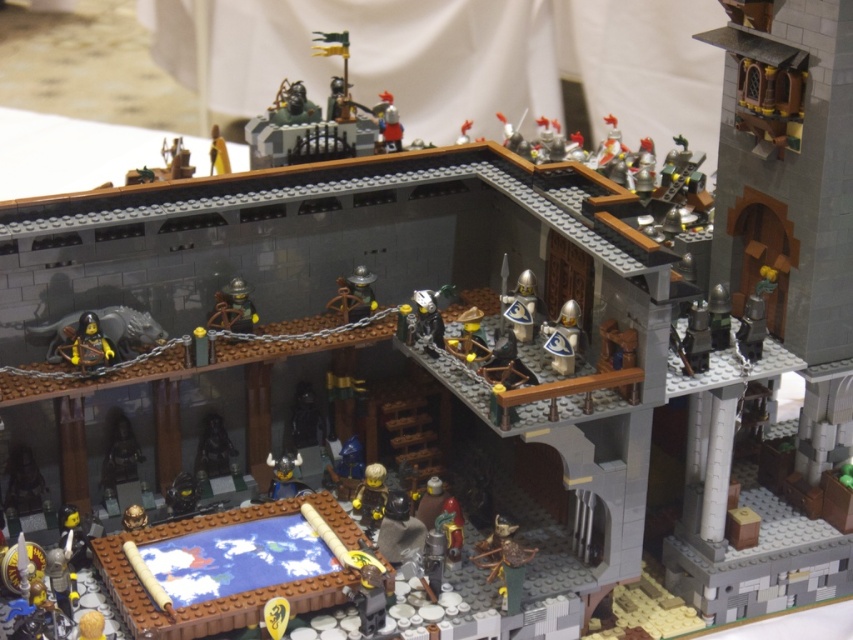
Question: Does matte black knight at center lie behind shiny silver helmet at center?

Choices:
 (A) no
 (B) yes

Answer: (B)

Question: Which point is closer to the camera?

Choices:
 (A) (245, 292)
 (B) (96, 332)

Answer: (B)

Question: Which point appears farthest from the camera in this image?

Choices:
 (A) (216, 422)
 (B) (213, 314)

Answer: (A)

Question: Can you confirm if shiny black minifigure at left is thinner than metallic silver helmet at center?

Choices:
 (A) yes
 (B) no

Answer: (B)

Question: Considering the relative positions of metallic silver helmet at center and matte black knight at center in the image provided, where is metallic silver helmet at center located with respect to matte black knight at center?

Choices:
 (A) below
 (B) above

Answer: (B)

Question: Which object appears closest to the camera in this image?

Choices:
 (A) shiny silver helmet at center
 (B) matte black knight at center
 (C) metallic silver helmet at center

Answer: (A)